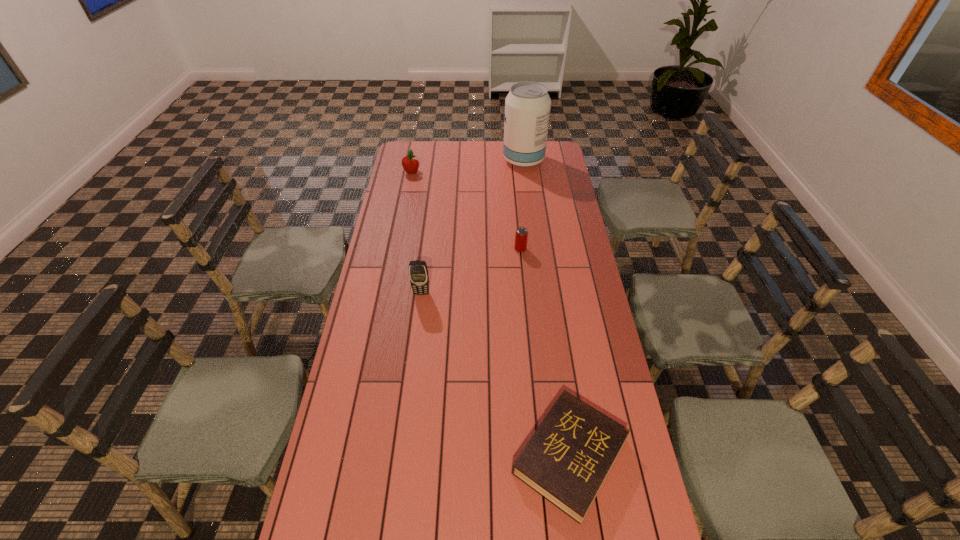
Where is `vacant space located 0.360m on the left of the beer can`? Image resolution: width=960 pixels, height=540 pixels. vacant space located 0.360m on the left of the beer can is located at coordinates (426, 249).

Locate an element on the screen. vacant area situated 0.050m on the back of the shortest object is located at coordinates (560, 385).

This screenshot has height=540, width=960. I want to click on object that is at the far edge, so click(x=527, y=106).

Locate an element on the screen. This screenshot has height=540, width=960. object that is at the left edge is located at coordinates (410, 163).

Find the location of a particular element. alcohol present at the right edge is located at coordinates (527, 106).

Locate an element on the screen. Image resolution: width=960 pixels, height=540 pixels. hardback book that is positioned at the right edge is located at coordinates (567, 459).

The image size is (960, 540). Identify the location of object that is at the far right corner. (527, 106).

Where is `vacant area at the far edge of the desktop`? vacant area at the far edge of the desktop is located at coordinates (491, 142).

The height and width of the screenshot is (540, 960). Identify the location of free spot at the left edge of the desktop. (396, 298).

Where is `vacant area at the right edge`? The height and width of the screenshot is (540, 960). vacant area at the right edge is located at coordinates pos(607,527).